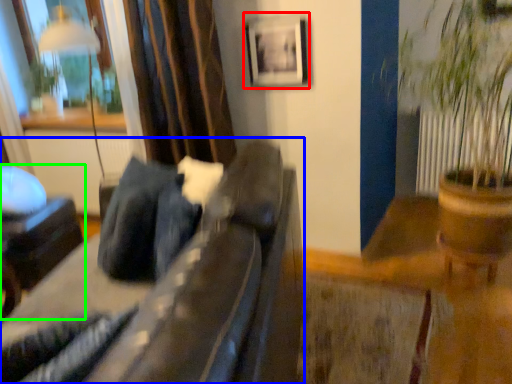
Question: Estimate the real-world distances between objects in this image. Which object is closer to picture frame (highlighted by a red box), furniture (highlighted by a blue box) or furniture (highlighted by a green box)?

Choices:
 (A) furniture
 (B) furniture

Answer: (A)